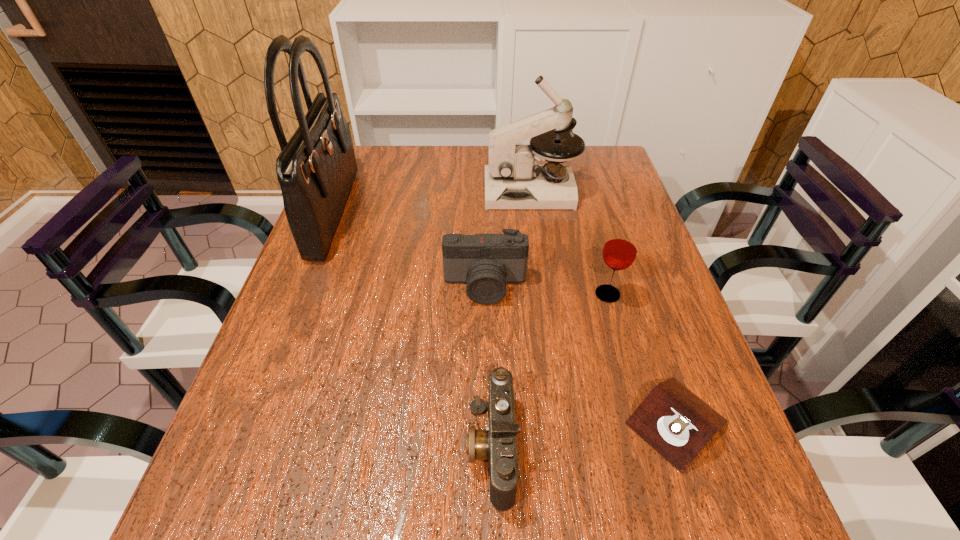
The image size is (960, 540). I want to click on handbag, so click(316, 168).

This screenshot has width=960, height=540. I want to click on the tallest object, so (x=316, y=168).

Locate an element on the screen. the fifth shortest object is located at coordinates (514, 179).

Identify the location of the third tallest object. (620, 249).

At what (x,y) coordinates should I click in order to perform the action: click on the farther camera. Please return your answer as a coordinate pair (x, y). The image size is (960, 540). Looking at the image, I should click on (485, 262).

Where is `the taller camera`? The height and width of the screenshot is (540, 960). the taller camera is located at coordinates (485, 262).

At what (x,y) coordinates should I click in order to perform the action: click on the shorter camera. Please return your answer as a coordinate pair (x, y). This screenshot has height=540, width=960. Looking at the image, I should click on (497, 443).

The width and height of the screenshot is (960, 540). What are the coordinates of `the fifth tallest object` in the screenshot? It's located at (497, 443).

At what (x,y) coordinates should I click in order to perform the action: click on book. Please return your answer as a coordinate pair (x, y). Looking at the image, I should click on (673, 420).

Where is `free region located with an open clasp on the front of the tallest object`? This screenshot has width=960, height=540. free region located with an open clasp on the front of the tallest object is located at coordinates (474, 211).